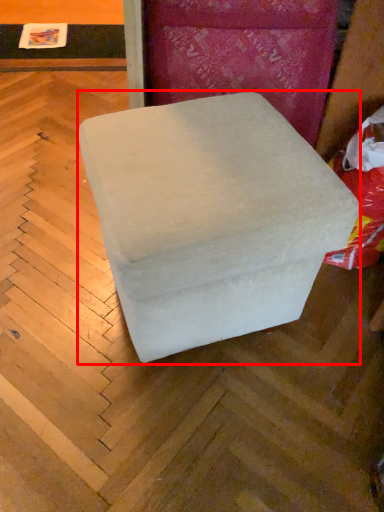
Question: From the image's perspective, where is furniture (annotated by the red box) located relative to bean bag chair?

Choices:
 (A) above
 (B) below

Answer: (B)